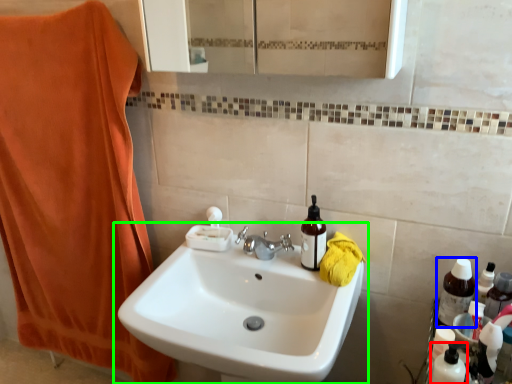
Question: Which object is positioned farthest from cleaning product (highlighted by a red box)? Select from bottle (highlighted by a blue box) and sink (highlighted by a green box).

Choices:
 (A) bottle
 (B) sink

Answer: (B)